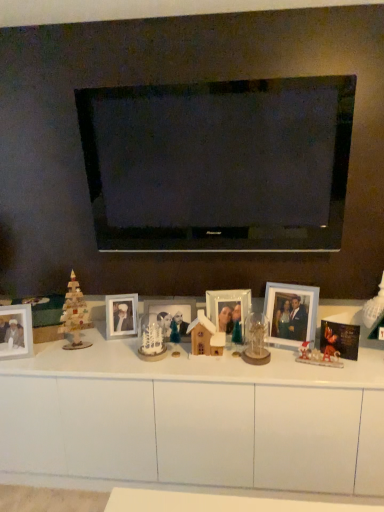
Locate an element on the screen. The height and width of the screenshot is (512, 384). free space in front of wooden house at center, the second toy in the left-to-right sequence is located at coordinates (203, 367).